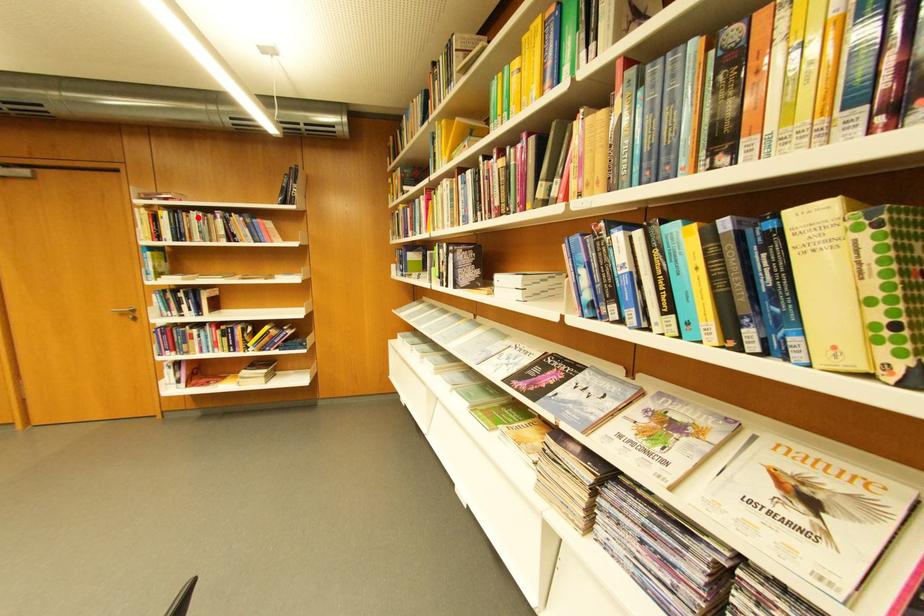
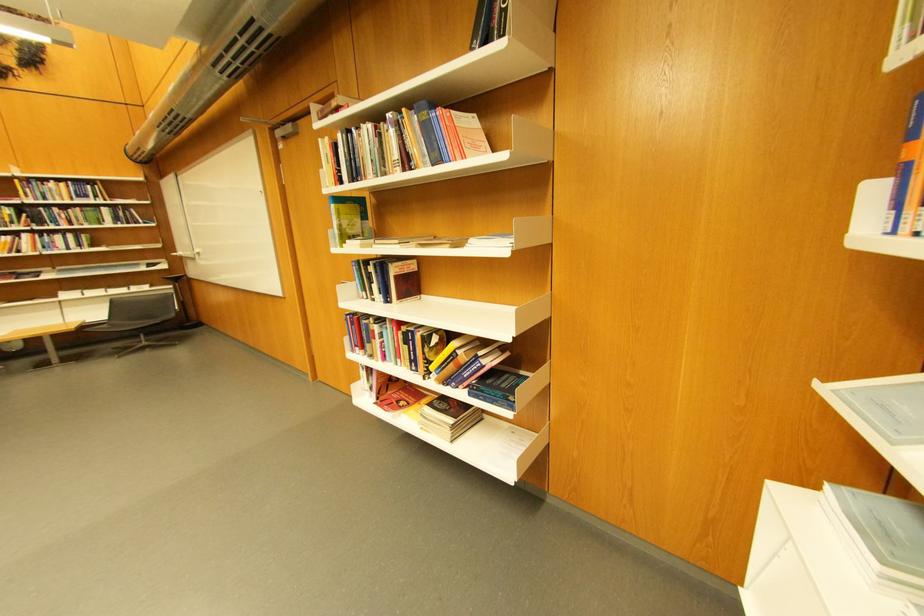
Where in the second image is the point corresponding to the highlighted location from the first image?

(370, 137)